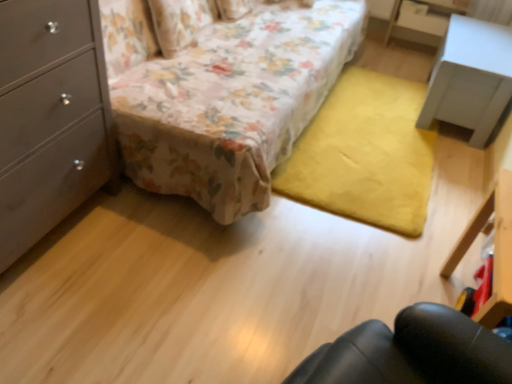
Locate an element on the screen. Image resolution: width=512 pixels, height=384 pixels. unoccupied space behind white matte nightstand at upper right is located at coordinates (400, 65).